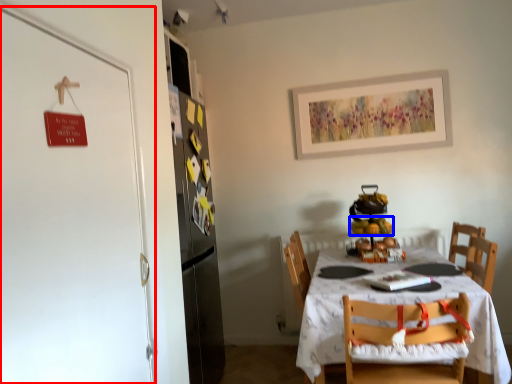
Question: Which object appears closest to the camera in this image, door (highlighted by a red box) or fruit (highlighted by a blue box)?

Choices:
 (A) door
 (B) fruit

Answer: (A)